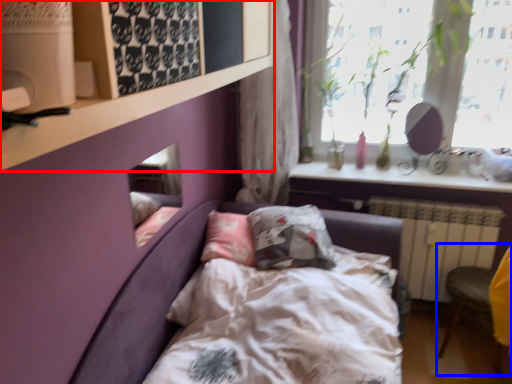
Question: Which of the following is the closest to the observer, shelf (highlighted by a red box) or armchair (highlighted by a blue box)?

Choices:
 (A) shelf
 (B) armchair

Answer: (A)